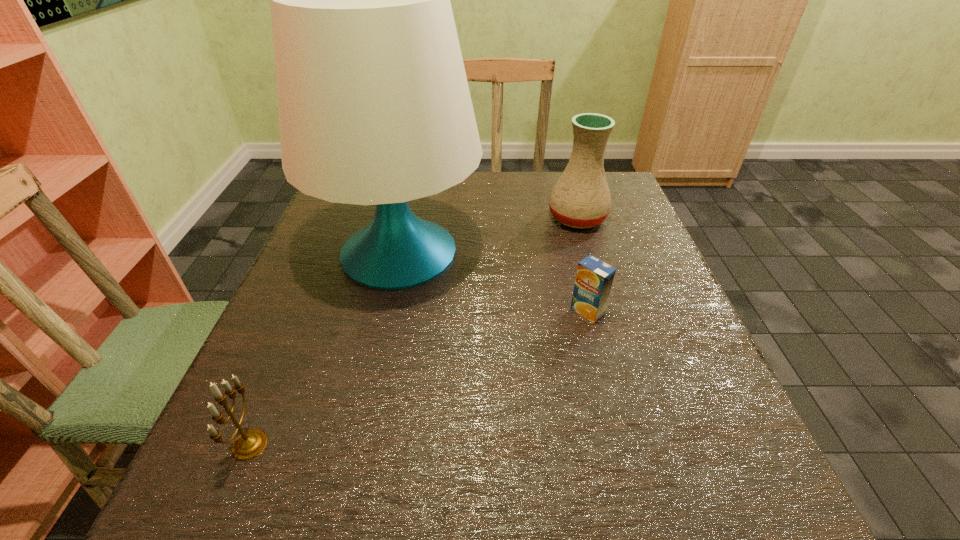
The width and height of the screenshot is (960, 540). What are the coordinates of `pottery located in the far edge section of the desktop` in the screenshot? It's located at (581, 198).

Where is `object present at the near edge`? object present at the near edge is located at coordinates (249, 444).

You are a GUI agent. You are given a task and a screenshot of the screen. Output one action in this format:
    pyautogui.click(x=<x>, y=<y>)
    Task: Click on the table lamp present at the left edge
    Image resolution: width=960 pixels, height=540 pixels.
    Given the screenshot: What is the action you would take?
    pyautogui.click(x=374, y=107)

The width and height of the screenshot is (960, 540). Identify the location of candelabrum situated at the left edge. (249, 444).

In order to click on pottery positioned at the right edge in this screenshot , I will do `click(581, 198)`.

The height and width of the screenshot is (540, 960). I want to click on orange_juice located at the right edge, so click(x=594, y=278).

Locate an element on the screen. This screenshot has height=540, width=960. object that is at the far left corner is located at coordinates (374, 107).

Where is `object present at the near left corner`? Image resolution: width=960 pixels, height=540 pixels. object present at the near left corner is located at coordinates (249, 444).

This screenshot has height=540, width=960. Identify the location of object that is at the far right corner. (581, 198).

Find the location of a particular element. This screenshot has width=960, height=540. vacant point at the far edge is located at coordinates (483, 196).